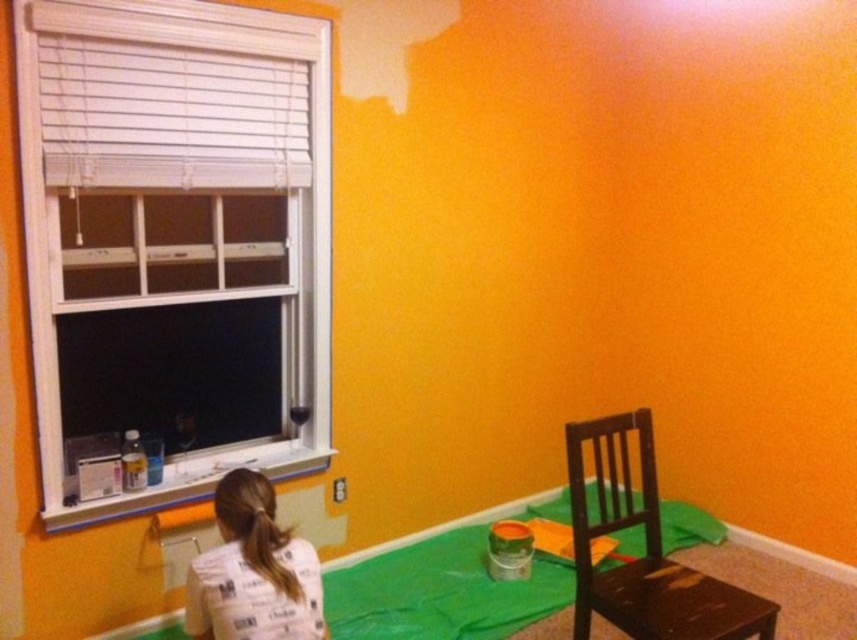
You are a painter standing in the room and need to determine if you can hang a 1.2 meter long painting on the wall between the white plastic window at left and the dark brown wooden chair at lower right. The painting requires at least 1 meter of vertical space. Can you do it?

The white plastic window at left is taller than the dark brown wooden chair at lower right. However, the scene description mentions a vibrant orange wall with an unpainted patch near the top left corner, suggesting that the area above the window might still be unpainted. Since the painting requires at least 1 meter of vertical space, and the window itself is taller than the chair, it is possible to hang the painting below the unpainted patch if the available space between the window and the chair allows.

In the scene shown: You are standing in the room and want to open the window to let some fresh air in. Based on the coordinates provided, where exactly should you go to locate the white plastic window at left?

The white plastic window at left is located at coordinates point (177, 198).

You are a painter working in this room. You need to place a new tool on the surface that is higher. Which object should you choose between the dark brown wooden chair at lower right and the white paper bag at lower center?

The white paper bag at lower center is higher than the dark brown wooden chair at lower right, so you should place the new tool on the white paper bag at lower center.